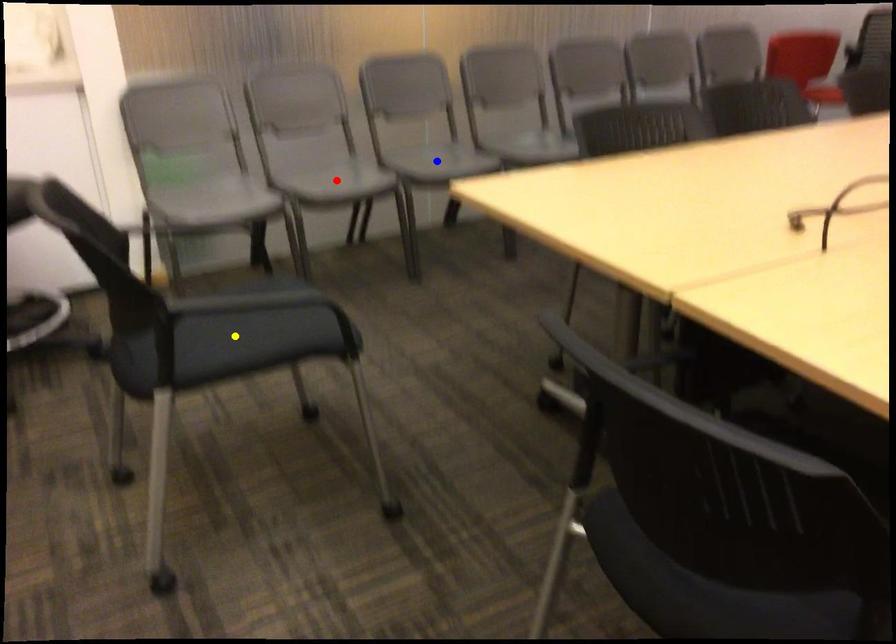
Order these from nearest to farthest:
red point | blue point | yellow point

yellow point → red point → blue point